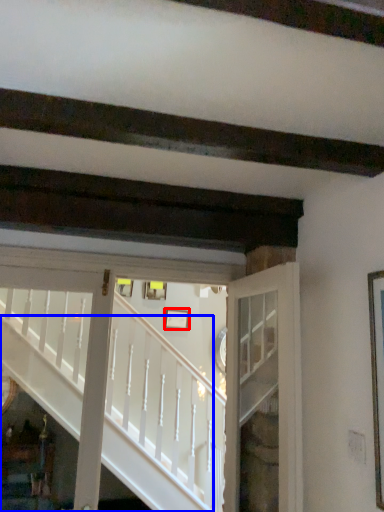
Question: Which point is further to the camera, picture frame (highlighted by a red box) or stairs (highlighted by a blue box)?

Choices:
 (A) picture frame
 (B) stairs

Answer: (A)